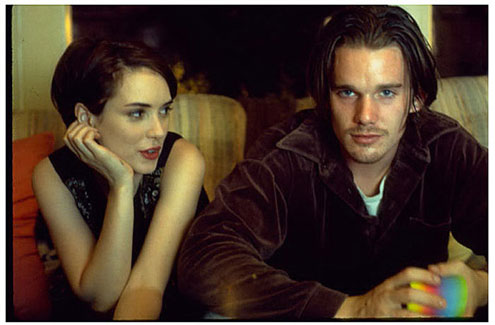
The image size is (495, 325). I want to click on orange pillow, so click(26, 286).